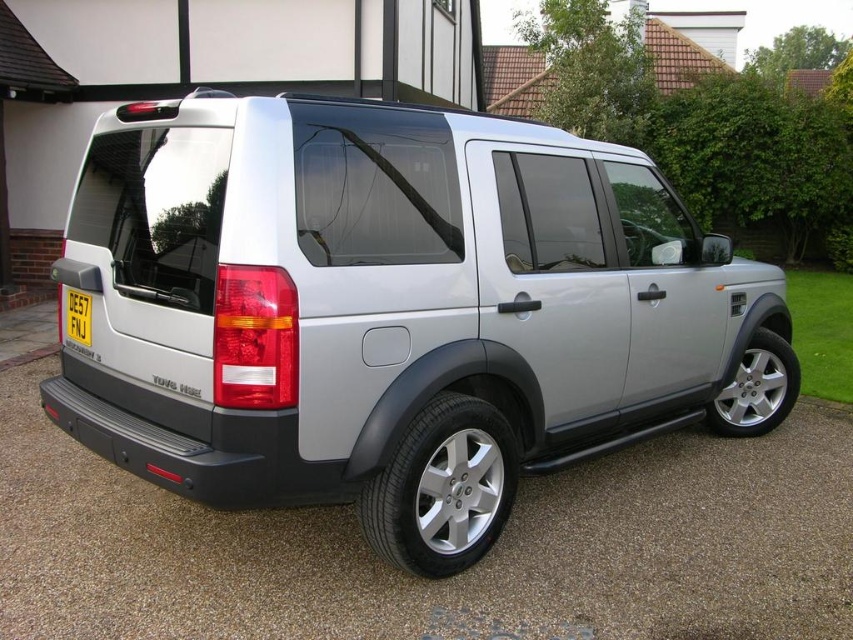
Which is more to the right, satin silver suv at center or silver metallic tire at lower center?

Positioned to the right is satin silver suv at center.

Does satin silver suv at center appear on the right side of silver metallic tire at lower center?

Correct, you'll find satin silver suv at center to the right of silver metallic tire at lower center.

Which is in front, point (196, 212) or point (445, 492)?

Point (196, 212) is in front.

Identify the location of satin silver suv at center. (383, 308).

Does point (830, 452) come in front of point (70, 305)?

No, it is not.

Which is in front, point (93, 468) or point (67, 289)?

Point (67, 289) is more forward.

You are a GUI agent. You are given a task and a screenshot of the screen. Output one action in this format:
    pyautogui.click(x=<x>, y=<y>)
    Task: Click on the gray asphalt at lower center
    
    Given the screenshot: What is the action you would take?
    [x=450, y=579]

Can you confirm if satin silver suv at center is positioned below silver metallic tire at lower right?

No.

Based on the photo, can you confirm if satin silver suv at center is wider than silver metallic tire at lower right?

Yes, satin silver suv at center is wider than silver metallic tire at lower right.

Is point (430, 349) positioned after point (714, 426)?

That is False.

Locate an element on the screen. This screenshot has height=640, width=853. satin silver suv at center is located at coordinates pyautogui.click(x=383, y=308).